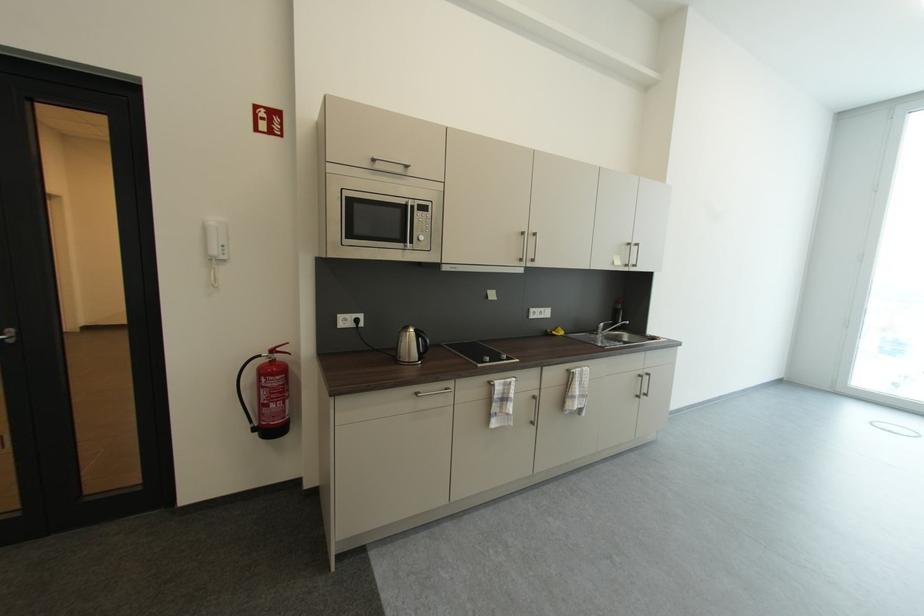
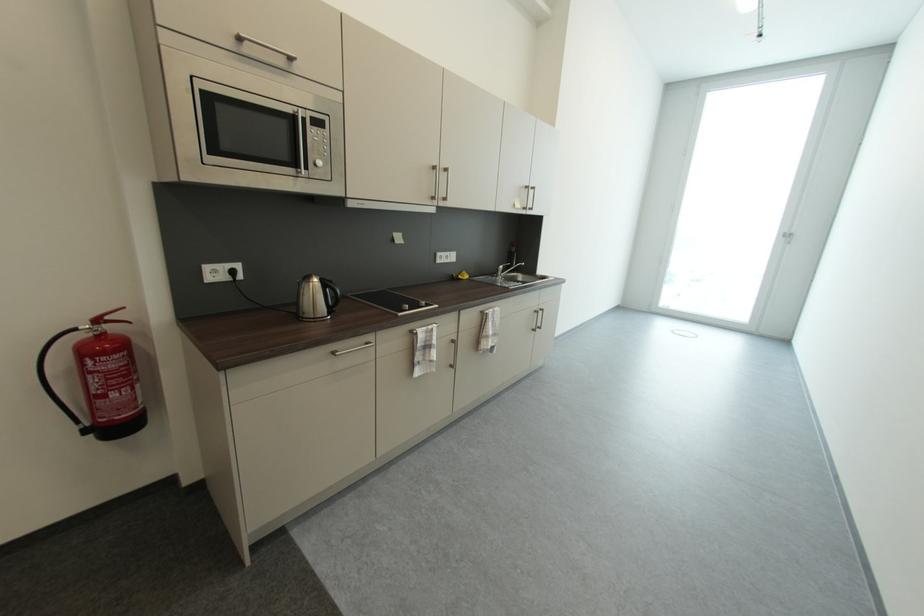
Question: The camera is either moving clockwise (left) or counter-clockwise (right) around the object. The first image is from the beginning of the video and the second image is from the end. Is the camera moving left or right when shooting the video?

Choices:
 (A) Left
 (B) Right

Answer: (A)